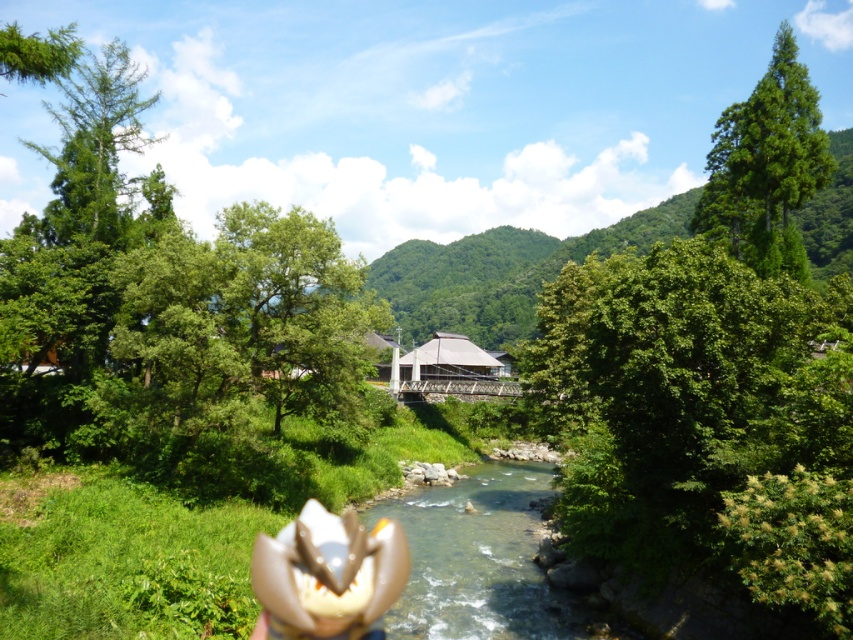
Question: Based on their relative distances, which object is nearer to the white matte flower at center?

Choices:
 (A) green matte tree at upper left
 (B) clear water at center
 (C) green glossy tree at upper right

Answer: (B)

Question: Based on their relative distances, which object is nearer to the white matte flower at center?

Choices:
 (A) green matte tree at upper left
 (B) green glossy tree at upper right
 (C) green leafy tree at center
 (D) green leafy tree at left

Answer: (C)

Question: Is green leafy tree at center positioned at the back of white matte flower at center?

Choices:
 (A) yes
 (B) no

Answer: (A)

Question: Among these objects, which one is farthest from the camera?

Choices:
 (A) green leafy tree at center
 (B) green leafy tree at left
 (C) green glossy tree at upper right

Answer: (C)

Question: Does green glossy tree at upper right appear under white matte flower at center?

Choices:
 (A) no
 (B) yes

Answer: (A)

Question: Is green leafy tree at left wider than green leafy tree at center?

Choices:
 (A) no
 (B) yes

Answer: (B)